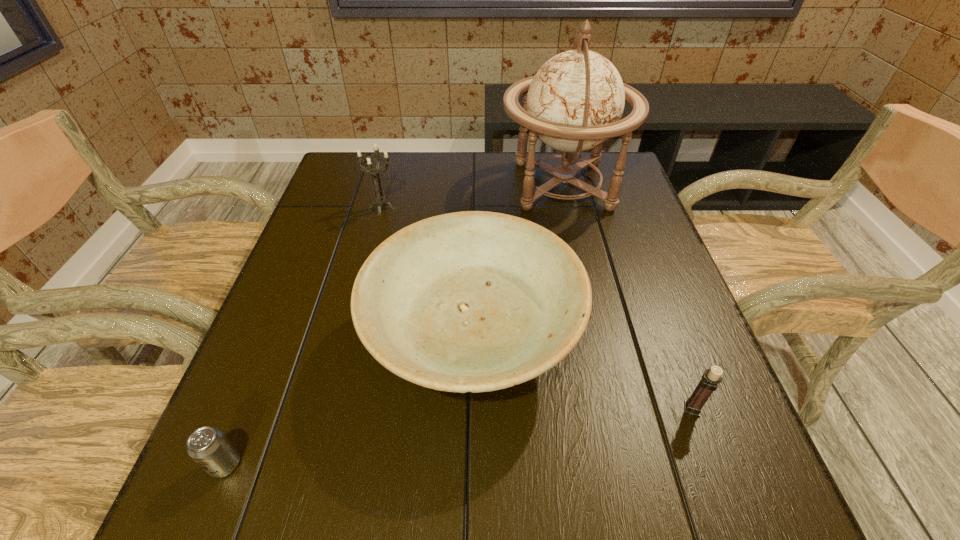
The image size is (960, 540). What are the coordinates of `globe` in the screenshot? It's located at (575, 101).

Where is `dish`? dish is located at coordinates (474, 301).

The image size is (960, 540). What are the coordinates of `the fourth object from right to left` in the screenshot? It's located at (380, 200).

At what (x,y) coordinates should I click in order to perform the action: click on the left candle holder. Please return your answer as a coordinate pair (x, y). The height and width of the screenshot is (540, 960). Looking at the image, I should click on (380, 200).

Where is `the right candle holder`? the right candle holder is located at coordinates (710, 379).

Find the location of a particular element. The image size is (960, 540). the nearer candle holder is located at coordinates (710, 379).

Where is `beer can`? beer can is located at coordinates (207, 446).

Where is `the leftmost object`? This screenshot has width=960, height=540. the leftmost object is located at coordinates click(207, 446).

At what (x,y) coordinates should I click in order to perform the action: click on vacant space situated at the front of the globe showing Africa. Please return your answer as a coordinate pair (x, y). The width and height of the screenshot is (960, 540). Looking at the image, I should click on (433, 185).

Find the location of `vacant region located at the front of the globe showing Africa`. vacant region located at the front of the globe showing Africa is located at coordinates pos(391,185).